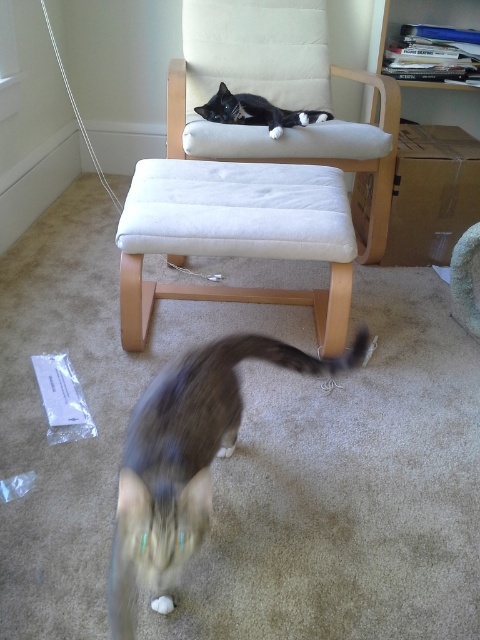
In the scene shown: You are standing in the room and see two points marked in the image. The first point is at position point (x=195, y=419) and the second is at point (x=242, y=118). Which point is closer to you?

Point (x=195, y=419) is in front of point (x=242, y=118), so it is closer to you.

You are a photographer setting up a camera to capture the two cats in the scene. You notice two specific points marked in the image at coordinates point (319, 8) and point (344, 330). Which of these points is closer to the camera lens?

Point (319, 8) is closer to the camera lens than point (344, 330) because it is further to the camera according to the description.

You are a cat owner who wants to place a small toy on the white fabric stool at center so that the black and white fur cat at upper center can reach it easily. Based on their sizes, will the toy placed on the stool be within the cat s reach?

The white fabric stool at center is bigger than the black and white fur cat at upper center. Since the stool is larger, the toy placed on it might be too high for the cat to reach comfortably, so it may need a lower surface.